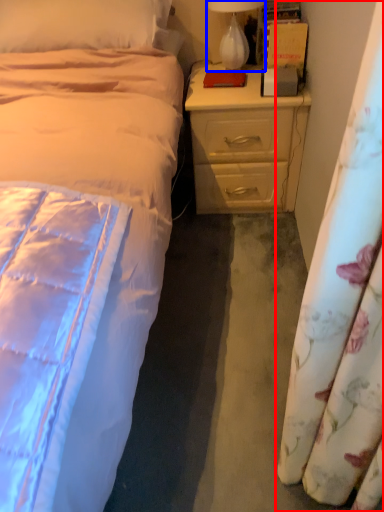
Question: Which point is further to the camera, curtain (highlighted by a red box) or lamp (highlighted by a blue box)?

Choices:
 (A) curtain
 (B) lamp

Answer: (B)